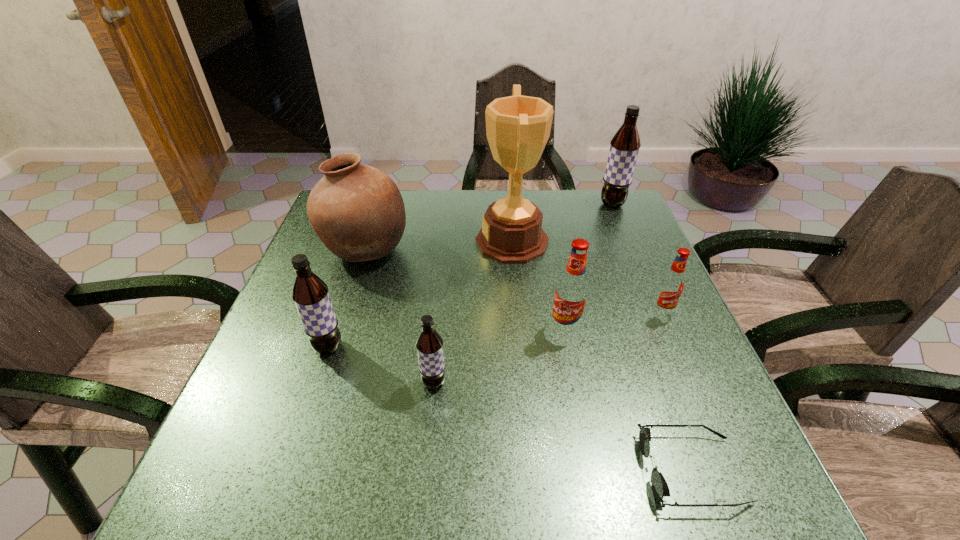
This screenshot has height=540, width=960. What are the coordinates of `free spot between the nearest object and the tallest root beer` in the screenshot? It's located at (652, 337).

This screenshot has width=960, height=540. Find the location of `vacant area that lies between the pottery and the smallest brown root beer`. vacant area that lies between the pottery and the smallest brown root beer is located at coordinates (400, 315).

Where is `vacant area that lies between the bigger red root beer and the second biggest brown root beer`? This screenshot has height=540, width=960. vacant area that lies between the bigger red root beer and the second biggest brown root beer is located at coordinates (446, 339).

The image size is (960, 540). In order to click on empty location between the right red root beer and the nearest root beer in this screenshot , I will do `click(548, 348)`.

Where is `vacant area that lies between the nearest brown root beer and the smaller red root beer`? vacant area that lies between the nearest brown root beer and the smaller red root beer is located at coordinates (548, 348).

The height and width of the screenshot is (540, 960). Identify the location of free space between the second brown root beer from left to right and the second nearest brown root beer. (381, 364).

The height and width of the screenshot is (540, 960). I want to click on free spot between the tallest object and the sunglasses, so click(602, 356).

Identify the location of free spot between the second nearest brown root beer and the farthest object. (470, 275).

The height and width of the screenshot is (540, 960). I want to click on free space between the tallest object and the leftmost root beer, so click(420, 294).

You are a GUI agent. You are given a task and a screenshot of the screen. Output one action in this format:
    pyautogui.click(x=<x>, y=<y>)
    Task: Click on the object that is the seventh closest to the pottery
    The image size is (960, 540).
    Given the screenshot: What is the action you would take?
    click(660, 488)